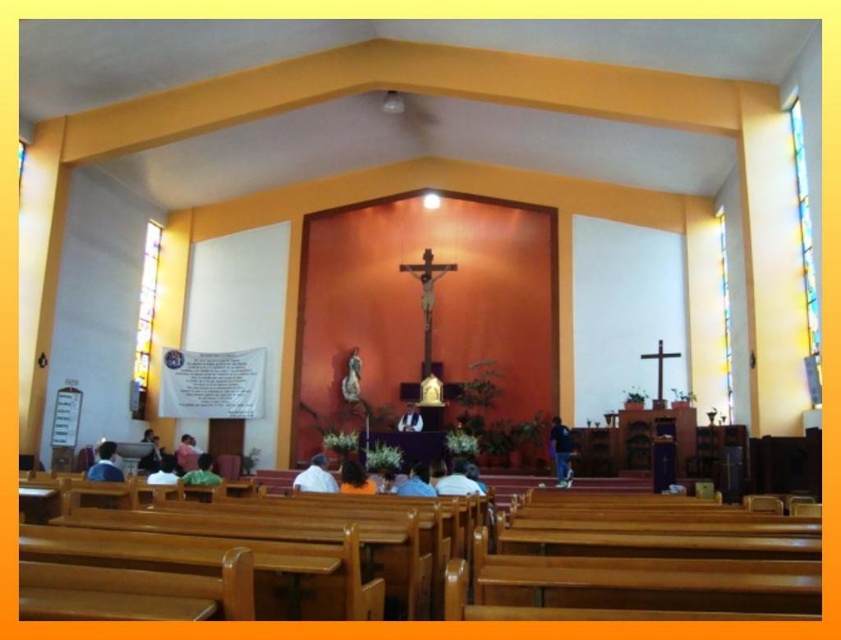
Question: Among these objects, which one is nearest to the camera?

Choices:
 (A) white fabric shirt at center
 (B) white glossy statue at center

Answer: (A)

Question: Does blue fabric shirt at center have a lesser width compared to white fabric at lower center?

Choices:
 (A) no
 (B) yes

Answer: (B)

Question: Can you confirm if dark blue fabric at center is bigger than brown leather jacket at center?

Choices:
 (A) no
 (B) yes

Answer: (B)

Question: Among these points, which one is farthest from the camera?

Choices:
 (A) [x=400, y=492]
 (B) [x=450, y=483]

Answer: (B)

Question: Is white matte shirt at center closer to camera compared to brown leather jacket at center?

Choices:
 (A) no
 (B) yes

Answer: (A)

Question: Among these points, which one is nearest to the camera?

Choices:
 (A) (426, 492)
 (B) (162, 474)

Answer: (A)